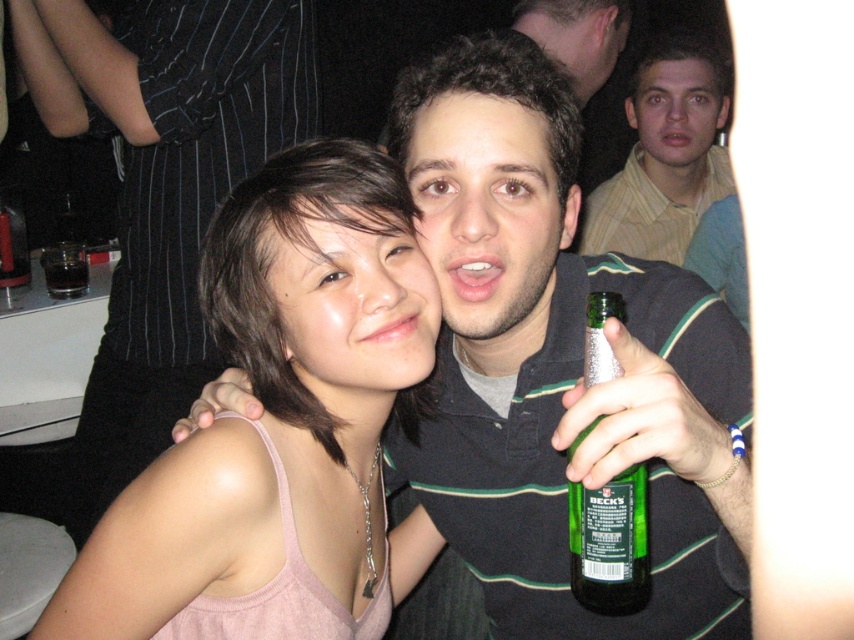
Question: Is green striped shirt at center below pink fabric tank top at center?

Choices:
 (A) yes
 (B) no

Answer: (A)

Question: Is pink fabric tank top at center positioned at the back of green glass bottle at center?

Choices:
 (A) no
 (B) yes

Answer: (B)

Question: Estimate the real-world distances between objects in this image. Which object is farther from the yellow striped shirt at upper right?

Choices:
 (A) green striped shirt at center
 (B) dark liquid glass at upper left

Answer: (A)

Question: Based on their relative distances, which object is nearer to the yellow striped shirt at upper right?

Choices:
 (A) pink fabric tank top at center
 (B) dark brown hair at upper center
 (C) green glass bottle at center

Answer: (B)

Question: Where is matte black shirt at upper center located in relation to yellow striped shirt at upper right in the image?

Choices:
 (A) right
 (B) left

Answer: (B)

Question: Which point is farther from the camera taking this photo?

Choices:
 (A) (168, 371)
 (B) (671, 96)
 (C) (68, 272)
 (D) (598, 522)

Answer: (B)